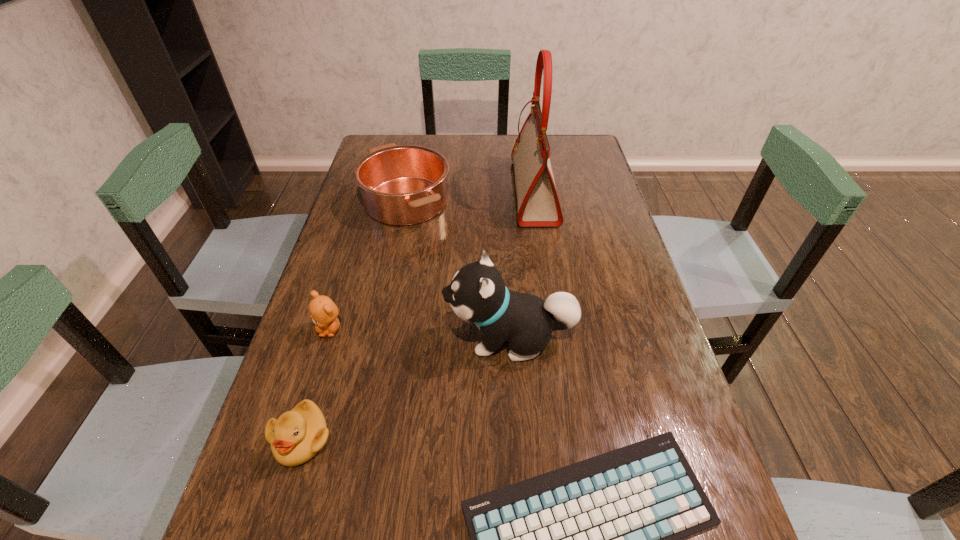
Identify the location of free spot between the fifth tallest object and the teddy bear. Image resolution: width=960 pixels, height=540 pixels. (316, 384).

In order to click on free space between the saucepan and the teddy bear in this screenshot , I will do `click(368, 265)`.

Where is `free space between the saucepan and the handbag`? The height and width of the screenshot is (540, 960). free space between the saucepan and the handbag is located at coordinates (470, 197).

Where is `unoccupied area between the saucepan and the tallest object`? This screenshot has height=540, width=960. unoccupied area between the saucepan and the tallest object is located at coordinates (470, 197).

Locate an element on the screen. This screenshot has width=960, height=540. unoccupied area between the handbag and the second tallest object is located at coordinates (522, 265).

Find the location of a particular element. This screenshot has height=540, width=960. vacant space that's between the tallest object and the teddy bear is located at coordinates (432, 260).

I want to click on vacant space in between the tallest object and the teddy bear, so click(x=432, y=260).

The width and height of the screenshot is (960, 540). What are the coordinates of `unoccupied position between the second shortest object and the puppy` in the screenshot? It's located at (406, 388).

The image size is (960, 540). I want to click on object that is the fifth closest to the shortest object, so click(x=538, y=204).

The image size is (960, 540). Identify the location of object that stands as the fifth closest to the tallest object. (298, 435).